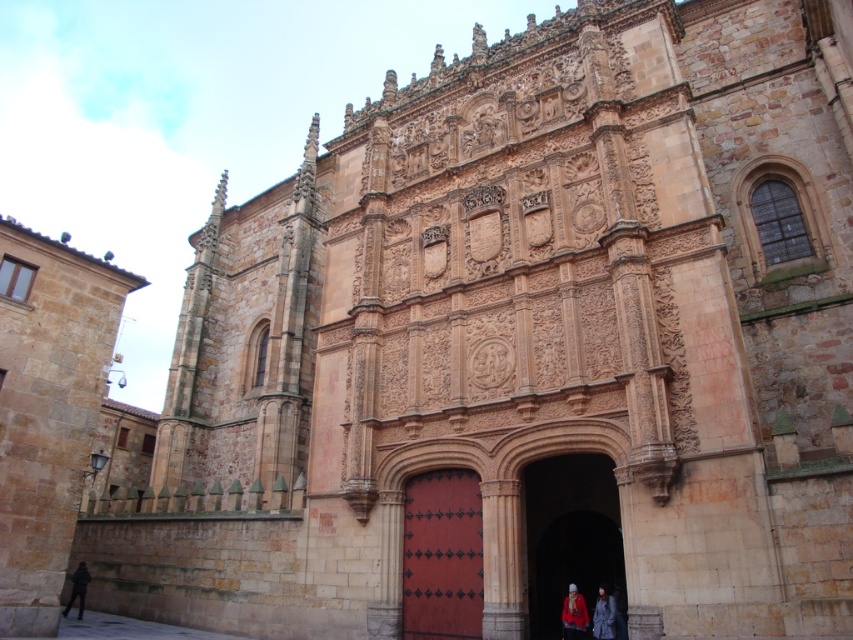
Can you confirm if red wool coat at center is positioned to the left of dark blue fabric coat at lower center?

Correct, you'll find red wool coat at center to the left of dark blue fabric coat at lower center.

Is red wool coat at center shorter than dark blue fabric coat at lower center?

Correct, red wool coat at center is not as tall as dark blue fabric coat at lower center.

This screenshot has height=640, width=853. Identify the location of red wool coat at center. (573, 614).

Is red wool coat at center thinner than red woolen hat at lower center?

Yes.

At what (x,y) coordinates should I click in order to perform the action: click on red wool coat at center. Please return your answer as a coordinate pair (x, y). The height and width of the screenshot is (640, 853). Looking at the image, I should click on (573, 614).

Find the location of a particular element. Image resolution: width=853 pixels, height=640 pixels. red wool coat at center is located at coordinates (x=573, y=614).

Consider the image. Between smooth red wood door at center and dark blue fabric coat at lower center, which one has less height?

dark blue fabric coat at lower center is shorter.

Does smooth red wood door at center have a lesser height compared to dark blue fabric coat at lower center?

No, smooth red wood door at center is not shorter than dark blue fabric coat at lower center.

Is point (477, 589) in front of point (593, 620)?

Yes.

I want to click on smooth red wood door at center, so click(442, 556).